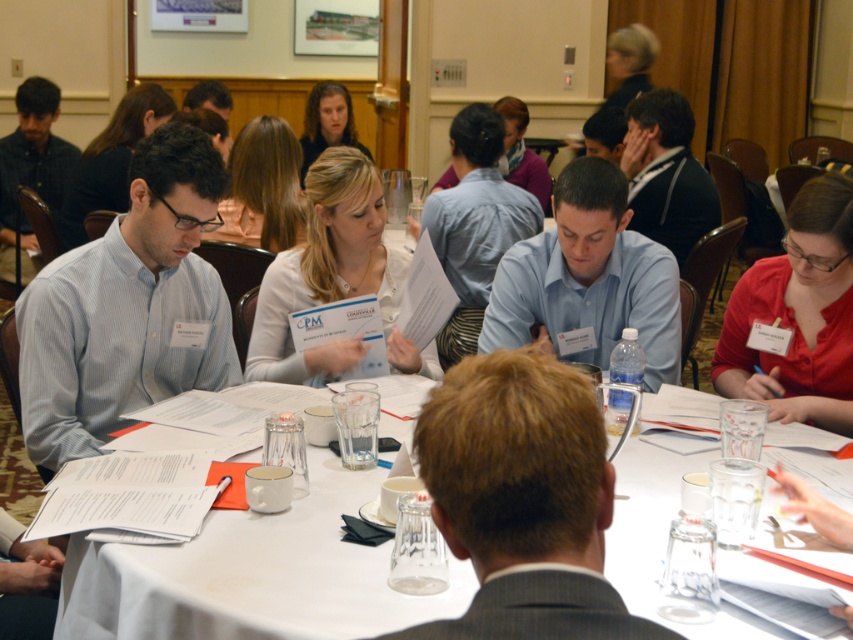
You are sitting at the round table and want to hand a document to the person with brown hair at center and the person with matte black shirt at center. Which person should you hand the document to first to minimize walking distance?

You should hand the document to the brown hair at center first because it is closer to you than the matte black shirt at center, so you can reach them without moving further away.

You are organizing a photo shoot for a fashion magazine and need to arrange two models wearing the matte black shirt at center and the matte black shirt at left. The requirement is that the model with the larger shirt should be placed in the foreground to emphasize their presence. Based on the scene description, which model should be positioned in the foreground?

The matte black shirt at left is larger than the matte black shirt at center, so the model wearing the matte black shirt at left should be positioned in the foreground to emphasize their presence.